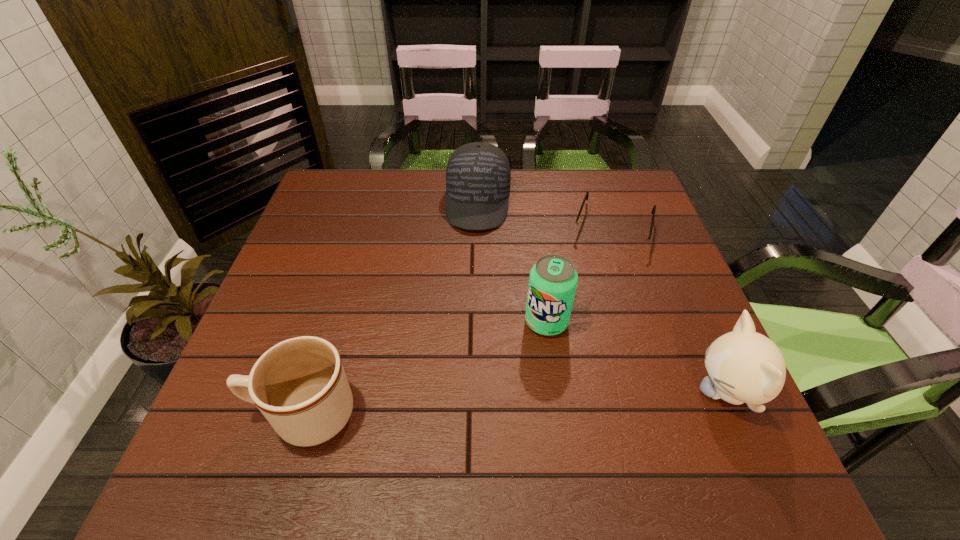
This screenshot has height=540, width=960. Find the location of `free space on the desktop that is between the leftmost object and the kitten and is positioned at the hinge ends of the spectacles`. free space on the desktop that is between the leftmost object and the kitten and is positioned at the hinge ends of the spectacles is located at coordinates (565, 401).

The image size is (960, 540). I want to click on vacant space on the desktop that is between the leftmost object and the kitten and is positioned at the front of the baseball cap where the brim is located, so click(x=458, y=406).

Where is `free spot on the desktop that is between the mug and the kitten and is positioned on the front-facing side of the pop soda`? free spot on the desktop that is between the mug and the kitten and is positioned on the front-facing side of the pop soda is located at coordinates (520, 403).